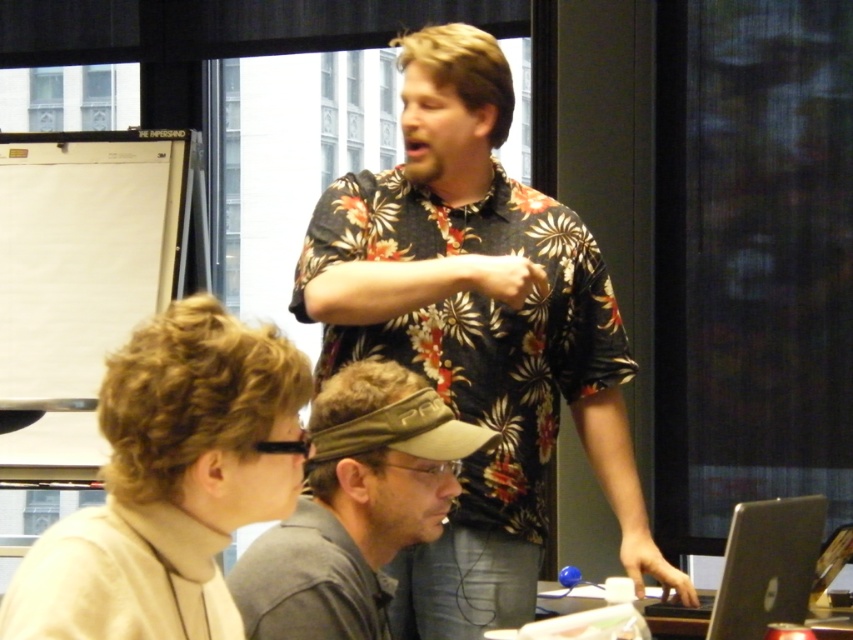
Can you confirm if beige turtleneck sweater at lower left is wider than gray fabric cap at center?

No, beige turtleneck sweater at lower left is not wider than gray fabric cap at center.

Where is `beige turtleneck sweater at lower left`? This screenshot has width=853, height=640. beige turtleneck sweater at lower left is located at coordinates (171, 483).

This screenshot has height=640, width=853. I want to click on beige turtleneck sweater at lower left, so click(x=171, y=483).

Does floral print shirt at center appear over silver metallic laptop at lower right?

Indeed, floral print shirt at center is positioned over silver metallic laptop at lower right.

Can you confirm if floral print shirt at center is wider than silver metallic laptop at lower right?

Yes, floral print shirt at center is wider than silver metallic laptop at lower right.

Identify the location of floral print shirt at center. Image resolution: width=853 pixels, height=640 pixels. (479, 333).

This screenshot has height=640, width=853. I want to click on floral print shirt at center, so click(479, 333).

What do you see at coordinates (479, 333) in the screenshot? Image resolution: width=853 pixels, height=640 pixels. I see `floral print shirt at center` at bounding box center [479, 333].

Between floral print shirt at center and beige turtleneck sweater at lower left, which one is positioned higher?

floral print shirt at center

You are a GUI agent. You are given a task and a screenshot of the screen. Output one action in this format:
    pyautogui.click(x=<x>, y=<y>)
    Task: Click on the floral print shirt at center
    
    Given the screenshot: What is the action you would take?
    pyautogui.click(x=479, y=333)

Find the location of a particular element. The width and height of the screenshot is (853, 640). floral print shirt at center is located at coordinates (479, 333).